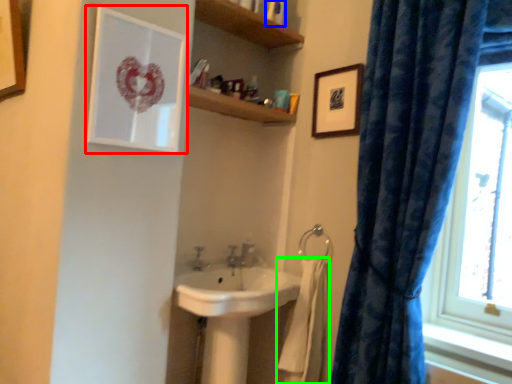
Question: Which object is the closest to the picture frame (highlighted by a red box)? Choose among these: toiletry (highlighted by a blue box) or bath towel (highlighted by a green box).

Choices:
 (A) toiletry
 (B) bath towel

Answer: (A)